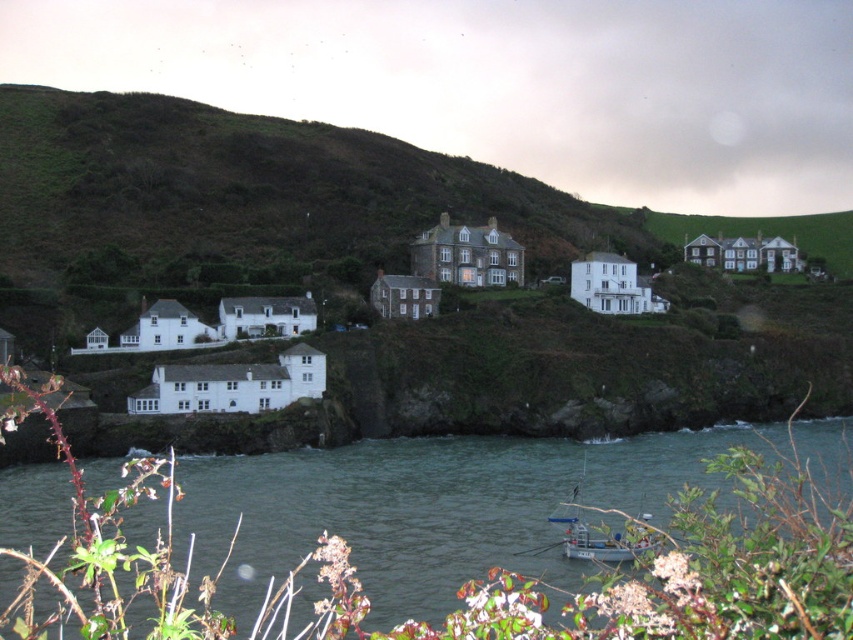
Between point (248, 557) and point (628, 552), which one is positioned behind?

The point (248, 557) is behind.

How far apart are clear water at lower center and metallic gray boat at lower center?

clear water at lower center and metallic gray boat at lower center are 14.49 meters apart from each other.

Locate an element on the screen. The width and height of the screenshot is (853, 640). clear water at lower center is located at coordinates (432, 502).

Locate an element on the screen. The image size is (853, 640). clear water at lower center is located at coordinates click(432, 502).

Between white painted wooden houses at center right and metallic gray boat at lower center, which one is positioned higher?

white painted wooden houses at center right is higher up.

Is point (689, 248) positioned in front of point (648, 515)?

No, it is behind (648, 515).

Locate an element on the screen. This screenshot has height=640, width=853. white painted wooden houses at center right is located at coordinates [x=743, y=253].

Does white matte house at center have a larger size compared to metallic gray boat at lower center?

Actually, white matte house at center might be smaller than metallic gray boat at lower center.

I want to click on white matte house at center, so click(x=612, y=285).

This screenshot has width=853, height=640. What do you see at coordinates (612, 285) in the screenshot?
I see `white matte house at center` at bounding box center [612, 285].

You are a GUI agent. You are given a task and a screenshot of the screen. Output one action in this format:
    pyautogui.click(x=<x>, y=<y>)
    Task: Click on the white matte house at center
    This screenshot has height=640, width=853.
    Given the screenshot: What is the action you would take?
    pyautogui.click(x=612, y=285)